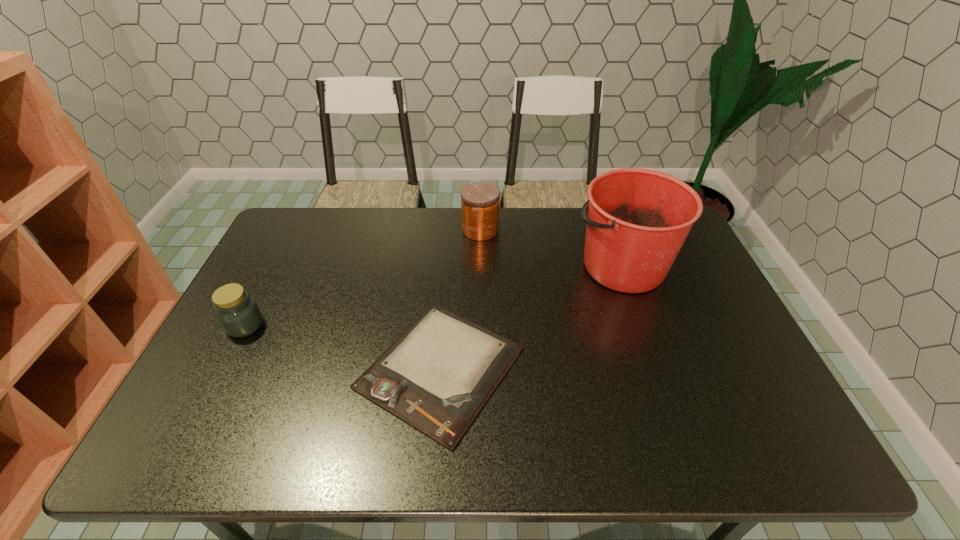
The height and width of the screenshot is (540, 960). Identify the location of blank area located 0.320m on the back of the shortest object. (451, 237).

You are a GUI agent. You are given a task and a screenshot of the screen. Output one action in this format:
    pyautogui.click(x=<x>, y=<y>)
    Task: Click on the bucket positioned at the far edge
    This screenshot has width=960, height=540.
    Given the screenshot: What is the action you would take?
    pyautogui.click(x=638, y=219)

What are the coordinates of `jar that is at the far edge` in the screenshot? It's located at (480, 201).

Locate an element on the screen. object positioned at the near edge is located at coordinates (437, 375).

At what (x,y) coordinates should I click in order to perform the action: click on object located in the left edge section of the desktop. Please return your answer as a coordinate pair (x, y). This screenshot has width=960, height=540. Looking at the image, I should click on (239, 315).

You are a GUI agent. You are given a task and a screenshot of the screen. Output one action in this format:
    pyautogui.click(x=<x>, y=<y>)
    Task: Click on the object situated at the right edge
    This screenshot has height=540, width=960.
    Given the screenshot: What is the action you would take?
    pyautogui.click(x=638, y=219)

The width and height of the screenshot is (960, 540). What are the coordinates of `object situated at the far right corner` in the screenshot? It's located at (638, 219).

You are a GUI agent. You are given a task and a screenshot of the screen. Output one action in this format:
    pyautogui.click(x=<x>, y=<y>)
    Task: Click on the vacant position at the far edge of the desktop
    Image resolution: width=960 pixels, height=540 pixels.
    Given the screenshot: What is the action you would take?
    pyautogui.click(x=535, y=213)

Identify the location of vacant point at the near edge. (558, 438).

Image resolution: width=960 pixels, height=540 pixels. I want to click on vacant space at the left edge, so click(x=264, y=257).